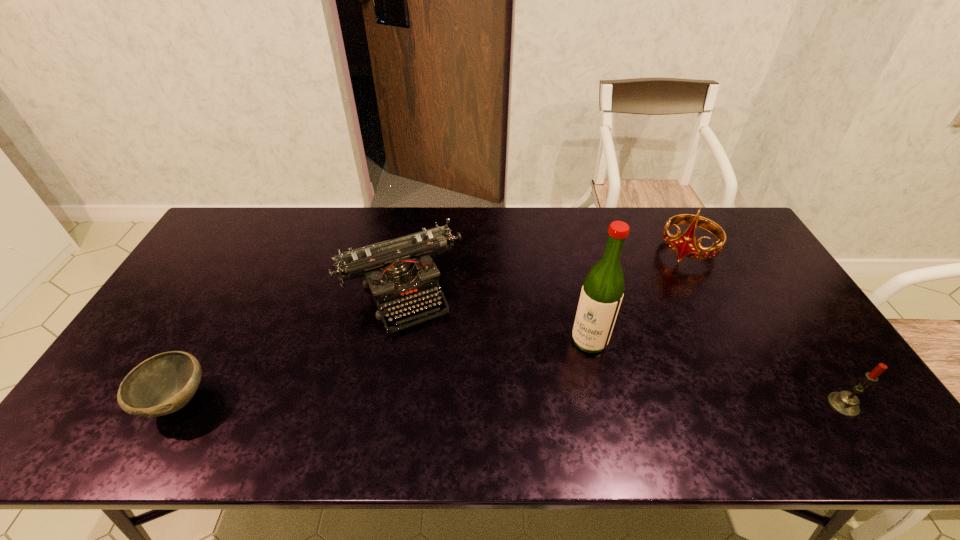
Find the location of a particular element. The image size is (960, 540). bowl positioned at the near edge is located at coordinates (163, 384).

The width and height of the screenshot is (960, 540). What are the coordinates of `candle that is at the near edge` in the screenshot? It's located at (845, 403).

I want to click on object located at the left edge, so click(163, 384).

Find the location of a particular element. This screenshot has height=540, width=960. candle that is at the right edge is located at coordinates coord(845,403).

Find the location of a particular element. The image size is (960, 540). tiara that is at the right edge is located at coordinates coord(685,245).

You are a GUI agent. You are given a task and a screenshot of the screen. Output one action in this format:
    pyautogui.click(x=<x>, y=<y>)
    Task: Click on the object located in the near left corner section of the desktop
    This screenshot has height=540, width=960.
    Given the screenshot: What is the action you would take?
    pyautogui.click(x=163, y=384)

Where is `object that is positioned at the far right corner`? object that is positioned at the far right corner is located at coordinates (685, 245).

At what (x,y) coordinates should I click in order to perform the action: click on object that is positioned at the near right corner. Please return your answer as a coordinate pair (x, y). The width and height of the screenshot is (960, 540). Looking at the image, I should click on (845, 403).

At what (x,y) coordinates should I click in order to perform the action: click on free space at the far edge of the desktop. Please return your answer as a coordinate pair (x, y). Looking at the image, I should click on (374, 233).

At what (x,y) coordinates should I click in order to perform the action: click on vacant region at the near edge. Please return your answer as a coordinate pair (x, y). Looking at the image, I should click on (500, 404).